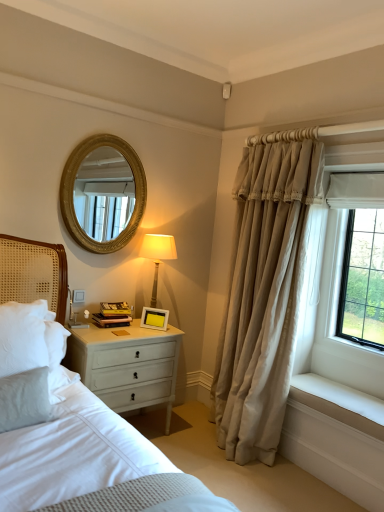
Locate an element on the screen. vacant space in front of hardcover books at bedside is located at coordinates (104, 329).